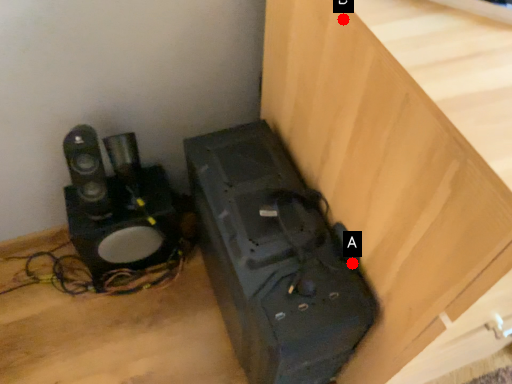
Question: Two points are circled on the image, labeled by A and B beside each circle. Which point appears farthest from the camera in this image?

Choices:
 (A) A is further
 (B) B is further

Answer: (A)